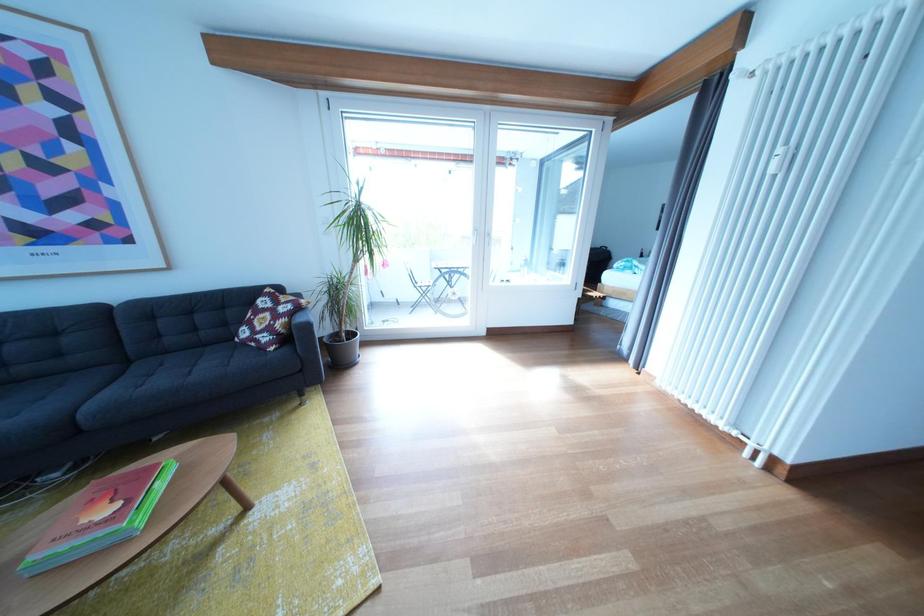
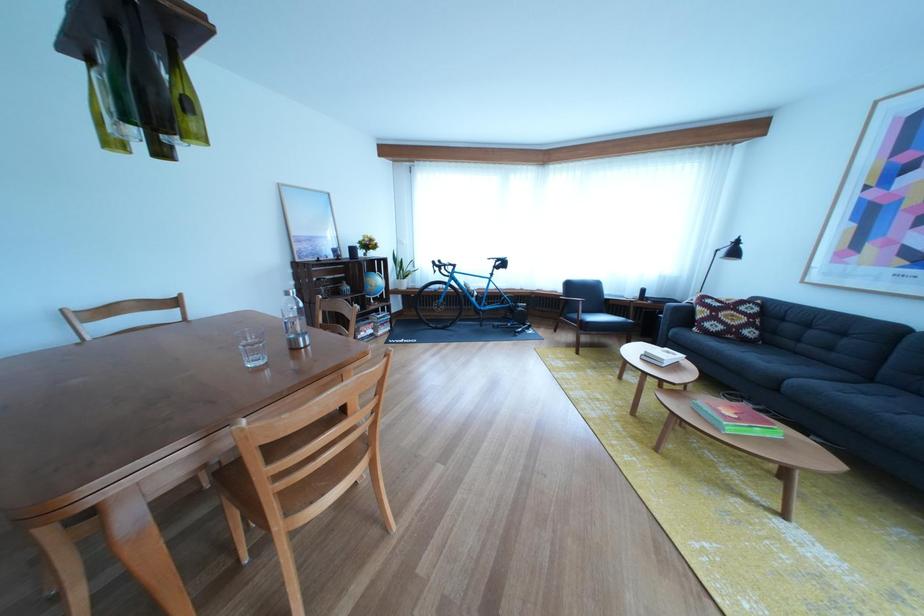
Where in the second image is the point corresponding to [152,525] from the first image?

(744, 435)